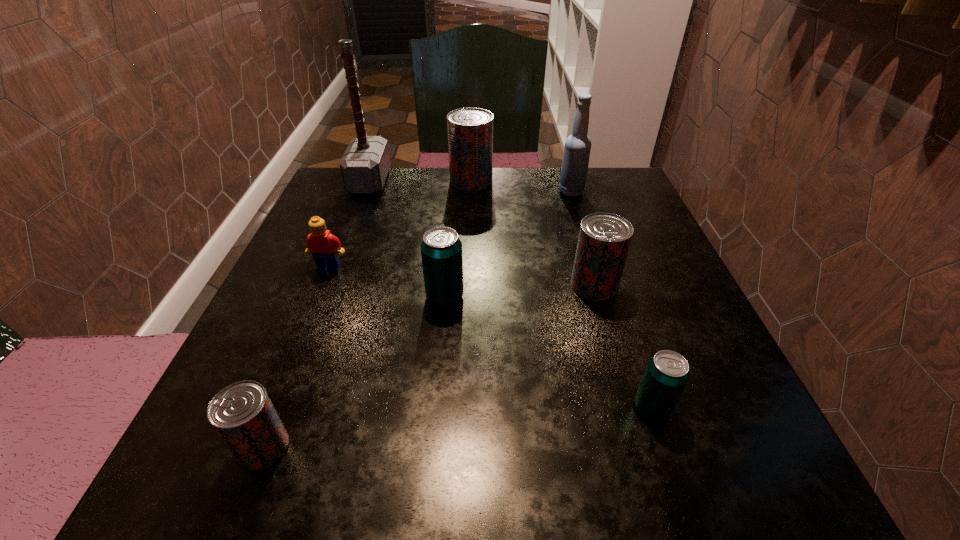
Identify the location of object at the far left corner. This screenshot has width=960, height=540. (365, 164).

Where is `object that is at the near left corner`? Image resolution: width=960 pixels, height=540 pixels. object that is at the near left corner is located at coordinates (242, 413).

Where is `object that is at the far right corner`? object that is at the far right corner is located at coordinates (577, 148).

What are the coordinates of `vacant space at the far edge of the desktop` in the screenshot? It's located at (508, 174).

Locate an element on the screen. free space at the near edge of the desktop is located at coordinates (639, 463).

Where is `vacant space at the left edge of the desktop`? vacant space at the left edge of the desktop is located at coordinates (309, 309).

Identify the location of vacant area at the right edge. (669, 317).

The height and width of the screenshot is (540, 960). In the image, there is a desktop. In order to click on free space at the near left corner in this screenshot , I will do `click(288, 456)`.

You are a GUI agent. You are given a task and a screenshot of the screen. Output one action in this format:
    pyautogui.click(x=<x>, y=<y>)
    Task: Click on the vacant space at the far right corner
    This screenshot has height=540, width=960.
    Given the screenshot: What is the action you would take?
    pyautogui.click(x=603, y=180)

In the image, there is a desktop. What are the coordinates of `vacant space at the near right corner` in the screenshot? It's located at (663, 450).